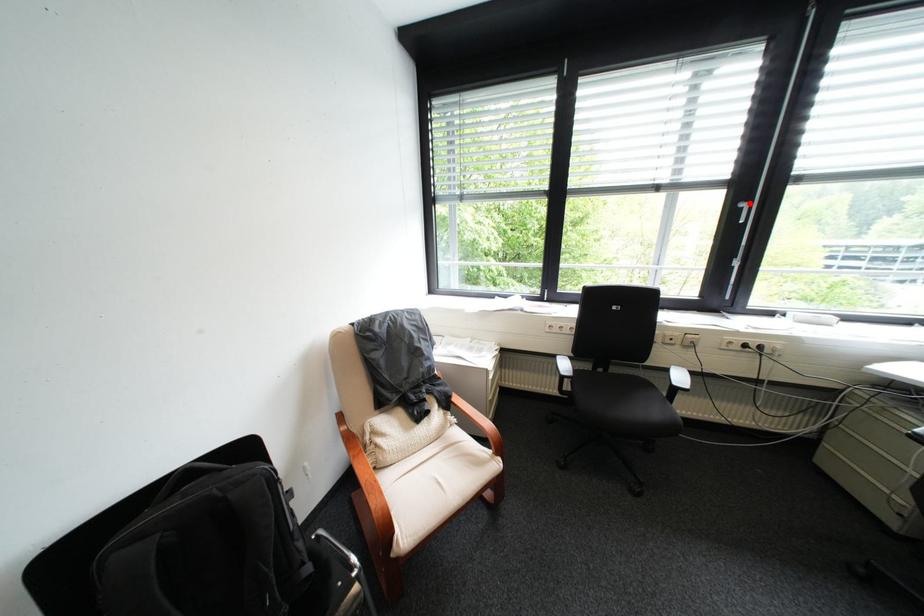
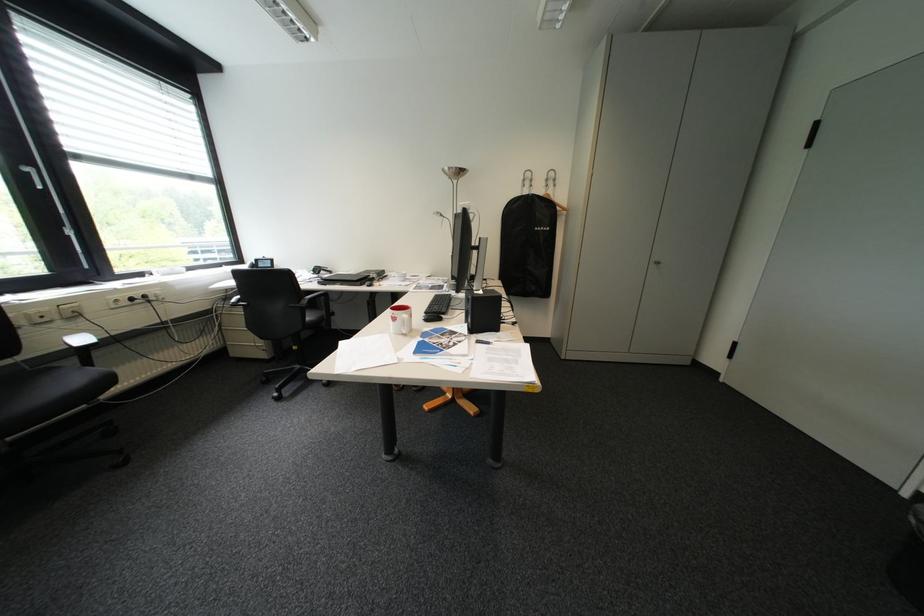
Find the pixel in the second image that matches the highlighted location in the first image.

(30, 167)